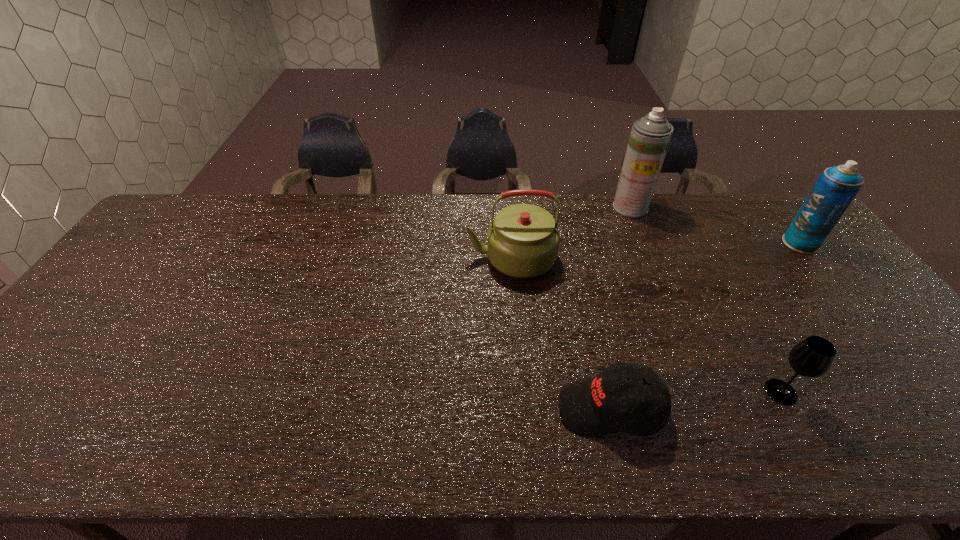
You are a GUI agent. You are given a task and a screenshot of the screen. Output one action in this format:
    pyautogui.click(x=<x>, y=<y>)
    Task: Click on the free space located at the spout of the kettle
    
    Given the screenshot: What is the action you would take?
    pyautogui.click(x=342, y=258)

This screenshot has height=540, width=960. In order to click on free space located at the spout of the kettle in this screenshot , I will do `click(384, 258)`.

Locate an element on the screen. free space located 0.320m at the spout of the kettle is located at coordinates (361, 258).

Identify the location of vacant area situated on the right of the fourth object from left to right. The height and width of the screenshot is (540, 960). (925, 392).

Identify the location of vacant space located on the front-facing side of the shortest object. (492, 409).

At what (x,y) coordinates should I click in order to perform the action: click on free spot located 0.390m on the front-facing side of the shortest object. Please return your answer as a coordinate pair (x, y). The width and height of the screenshot is (960, 540). Looking at the image, I should click on (385, 409).

Find the location of a particular element. The width and height of the screenshot is (960, 540). vacant region located on the front-facing side of the shortest object is located at coordinates (514, 409).

The width and height of the screenshot is (960, 540). What are the coordinates of `kettle that is at the far edge` in the screenshot? It's located at (523, 241).

I want to click on object at the near edge, so click(x=591, y=407).

In order to click on object located in the right edge section of the desktop in this screenshot , I will do `click(835, 189)`.